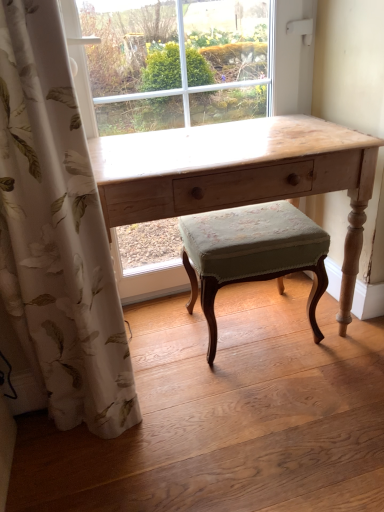
You are a GUI agent. You are given a task and a screenshot of the screen. Output one action in this format:
    pyautogui.click(x=<x>, y=<y>)
    Task: Click on the vacant space in white floral fabric curtain at left (from a real-world perspective)
    Image resolution: width=384 pixels, height=512 pixels.
    Given the screenshot: What is the action you would take?
    pyautogui.click(x=72, y=431)